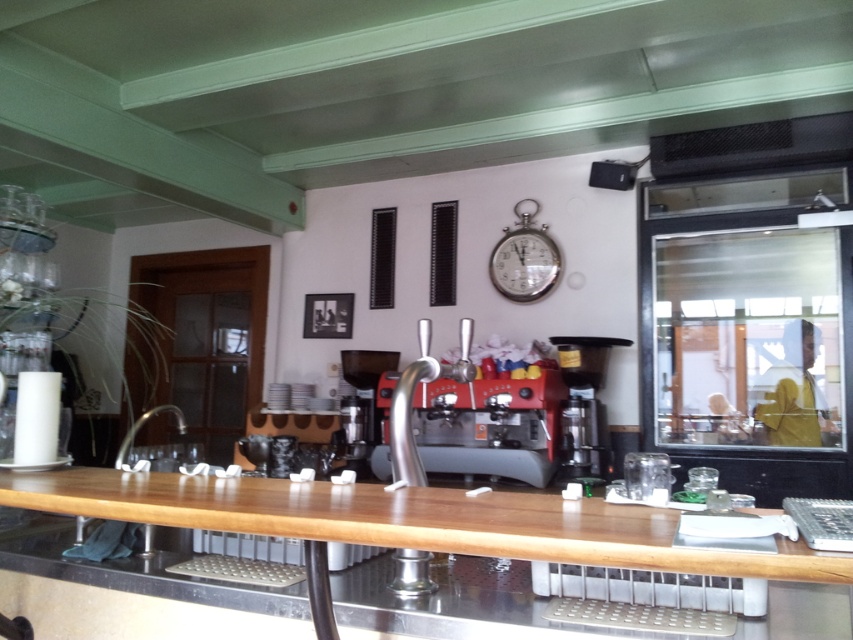
You are a barista working at the wooden bar counter in the foreground. You need to place an order for a customer who wants an espresso. The espresso machine is the black plastic coffee machine at center. Since you have to reach it from the wooden at center, which is to your left, can you move directly to it without moving around any obstacles?

The wooden at center is positioned on the left side of the black plastic coffee machine at center, so yes, you can move directly to the black plastic coffee machine at center from the wooden at center without needing to go around any obstacles since they are aligned along the same axis.

You are a barista working at the counter. You need to place a large coffee cup that requires 30 cm of space. The wooden at center and the silver metallic clock at upper center are on the counter. Which object can accommodate the cup?

The wooden at center is larger in size than the silver metallic clock at upper center, so the wooden at center can accommodate the large coffee cup needing 30 cm of space.